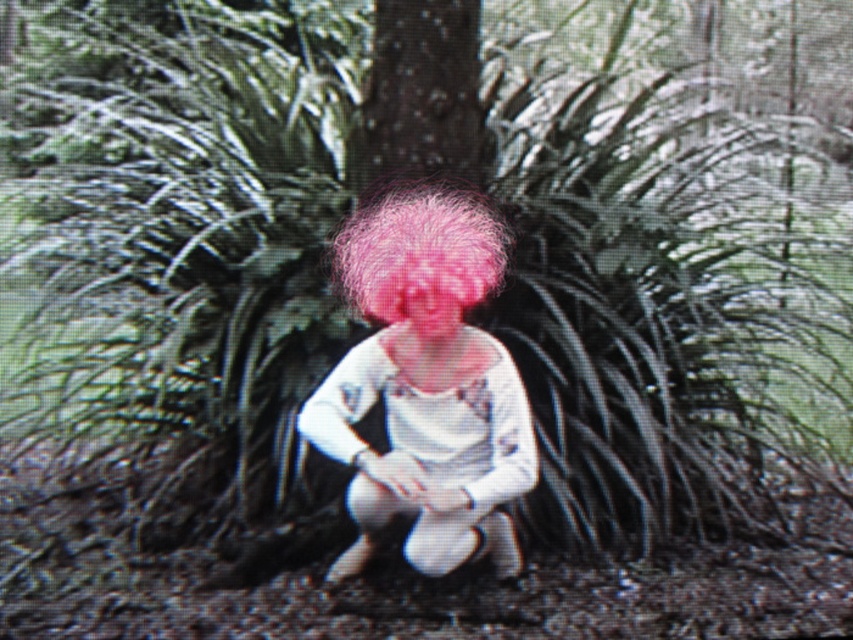
Does fuzzy pink hair at center lie behind pink fluffy wig at center?

Yes.

Is point (370, 317) more distant than point (416, 284)?

Yes, point (370, 317) is behind point (416, 284).

Is point (335, 262) positioned behind point (428, 330)?

That is True.

Where is `fuzzy pink hair at center`? This screenshot has height=640, width=853. fuzzy pink hair at center is located at coordinates (419, 250).

Is fuzzy pink wig at center thinner than fuzzy pink hair at center?

No.

Does fuzzy pink wig at center have a greater height compared to fuzzy pink hair at center?

Yes, fuzzy pink wig at center is taller than fuzzy pink hair at center.

What are the coordinates of `fuzzy pink wig at center` in the screenshot? It's located at (426, 388).

Does fuzzy pink wig at center have a smaller size compared to pink fluffy wig at center?

Actually, fuzzy pink wig at center might be larger than pink fluffy wig at center.

Does fuzzy pink wig at center appear on the left side of pink fluffy wig at center?

Correct, you'll find fuzzy pink wig at center to the left of pink fluffy wig at center.

Find the location of a particular element. fuzzy pink wig at center is located at coordinates (426, 388).

Where is `fuzzy pink wig at center`? The height and width of the screenshot is (640, 853). fuzzy pink wig at center is located at coordinates (426, 388).